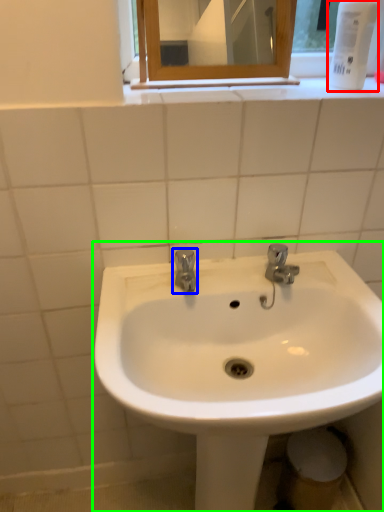
Question: Which is nearer to the mouthwash (highlighted by a red box)? tap (highlighted by a blue box) or sink (highlighted by a green box).

Choices:
 (A) tap
 (B) sink

Answer: (A)